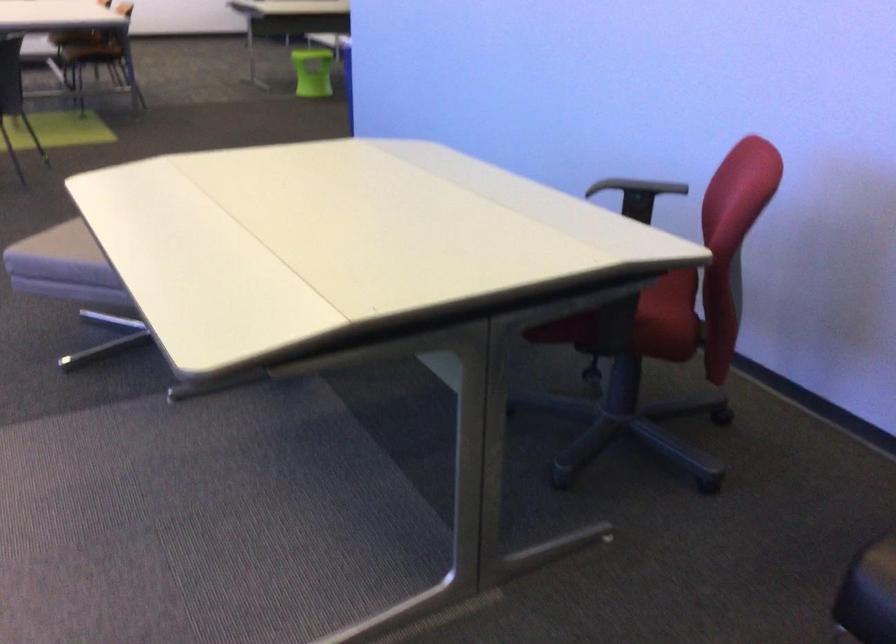
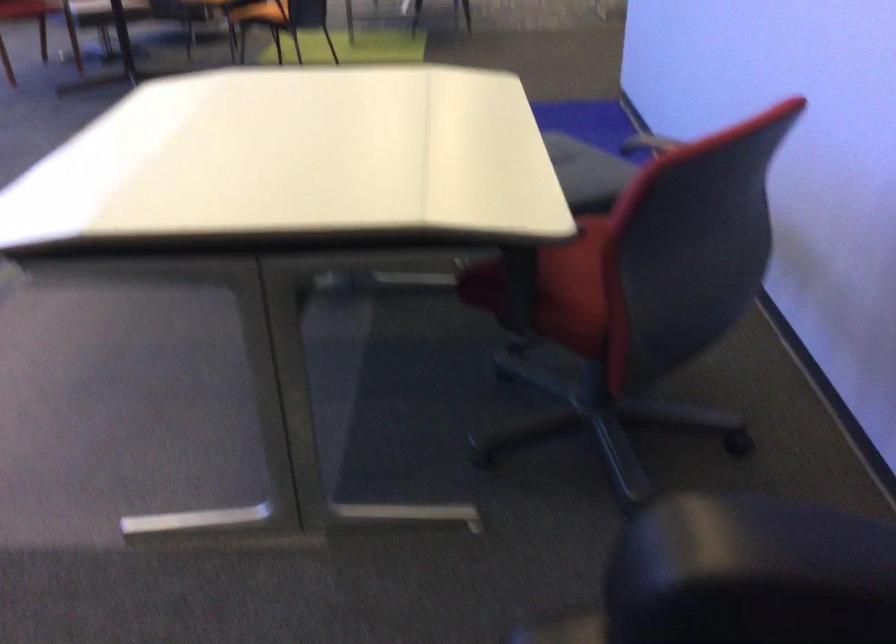
Question: The camera is either moving clockwise (left) or counter-clockwise (right) around the object. The first image is from the beginning of the video and the second image is from the end. Is the camera moving left or right when shooting the video?

Choices:
 (A) Left
 (B) Right

Answer: (B)